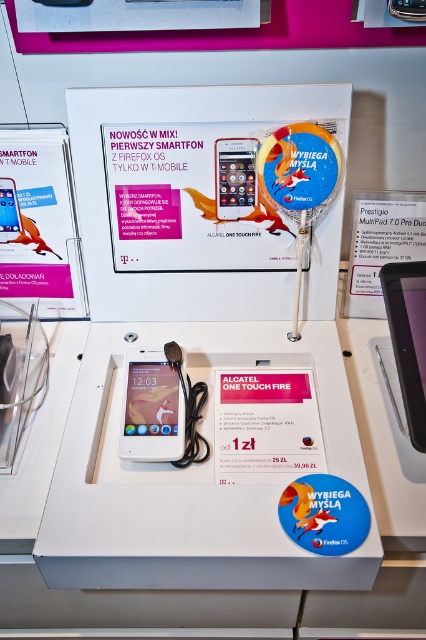
What is located at the coordinates point (150, 406)?

The white glossy ipod at center is located at point (150, 406).

What are the coordinates of the white glossy ipod at center in the image?

The white glossy ipod at center is located at coordinates point [150,406].